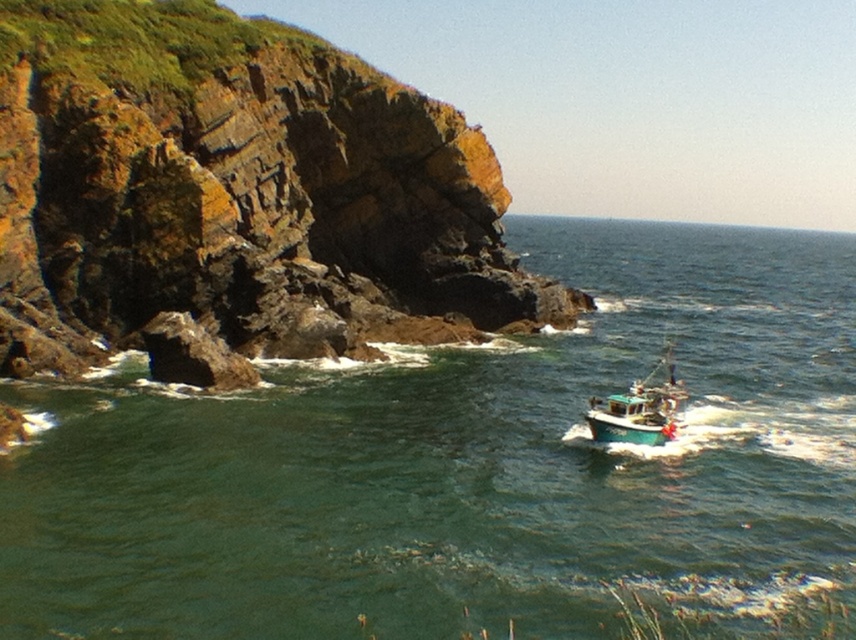
Which of these two, rusty rock at left or teal matte fishing boat at lower right, stands taller?

rusty rock at left is taller.

Who is lower down, rusty rock at left or teal matte fishing boat at lower right?

Result: teal matte fishing boat at lower right is below.

Describe the element at coordinates (236, 193) in the screenshot. I see `rusty rock at left` at that location.

You are a GUI agent. You are given a task and a screenshot of the screen. Output one action in this format:
    pyautogui.click(x=<x>, y=<y>)
    Task: Click on the rusty rock at left
    The width and height of the screenshot is (856, 640).
    Given the screenshot: What is the action you would take?
    pyautogui.click(x=236, y=193)

Does green water at lower center have a greater height compared to teal matte fishing boat at lower right?

Yes.

What do you see at coordinates (464, 465) in the screenshot? This screenshot has width=856, height=640. I see `green water at lower center` at bounding box center [464, 465].

Identify the location of green water at lower center. The width and height of the screenshot is (856, 640). (464, 465).

Is green water at lower center taller than rusty rock at left?

Yes, green water at lower center is taller than rusty rock at left.

What do you see at coordinates (464, 465) in the screenshot? Image resolution: width=856 pixels, height=640 pixels. I see `green water at lower center` at bounding box center [464, 465].

Does point (485, 621) come closer to viewer compared to point (391, 289)?

Yes, point (485, 621) is in front of point (391, 289).

The height and width of the screenshot is (640, 856). I want to click on green water at lower center, so click(x=464, y=465).